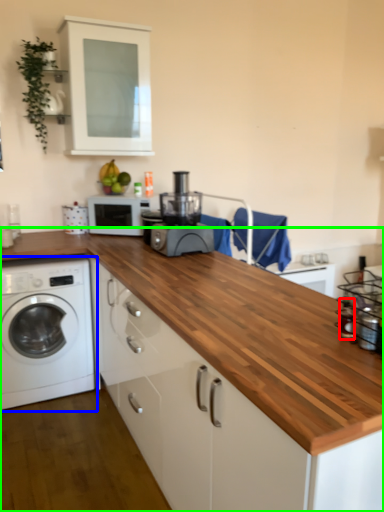
Question: Considering the real-world distances, which object is closest to bottle (highlighted by a red box)? washing machine (highlighted by a blue box) or countertop (highlighted by a green box).

Choices:
 (A) washing machine
 (B) countertop

Answer: (B)